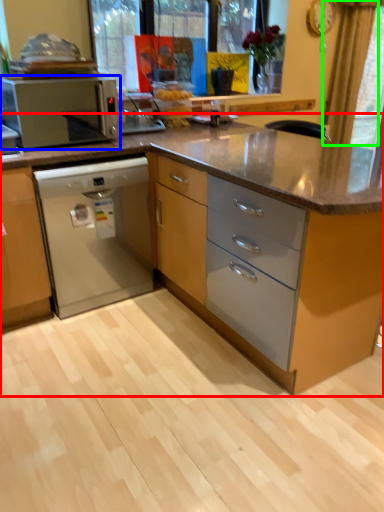
Question: Considering the real-world distances, which object is farthest from cabinetry (highlighted by a red box)? kitchen appliance (highlighted by a blue box) or curtain (highlighted by a green box)?

Choices:
 (A) kitchen appliance
 (B) curtain

Answer: (A)